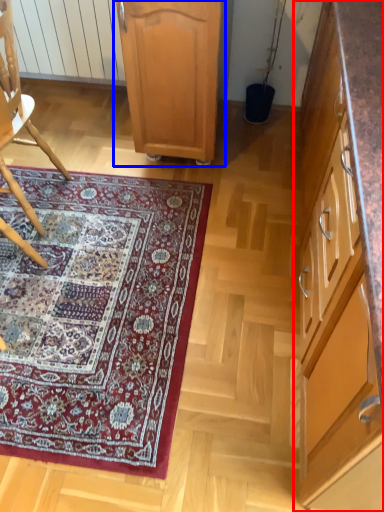
Question: Which object appears farthest to the camera in this image, cabinetry (highlighted by a red box) or cabinetry (highlighted by a blue box)?

Choices:
 (A) cabinetry
 (B) cabinetry

Answer: (B)